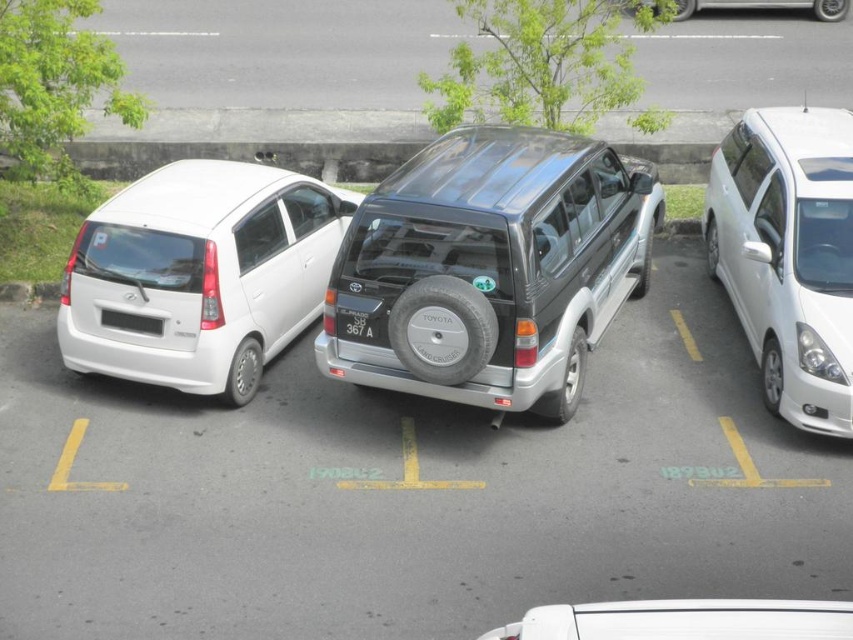
Can you confirm if satin silver suv at center is bigger than white matte car at center?

Indeed, satin silver suv at center has a larger size compared to white matte car at center.

Is point (582, 198) in front of point (851, 632)?

No, (582, 198) is behind (851, 632).

Where is `satin silver suv at center`? satin silver suv at center is located at coordinates pos(492,268).

Does white glossy minivan at right appear under black plastic license plate at rear?

Actually, white glossy minivan at right is above black plastic license plate at rear.

Between white glossy minivan at right and black plastic license plate at rear, which one is positioned lower?

black plastic license plate at rear

Who is more distant from viewer, (761, 246) or (160, 320)?

The point (761, 246) is more distant.

Locate an element on the screen. white glossy minivan at right is located at coordinates (788, 256).

Which is more to the left, white glossy minivan at right or metallic silver car at upper right?

white glossy minivan at right is more to the left.

Is white glossy minivan at right behind metallic silver car at upper right?

No, white glossy minivan at right is closer to the viewer.

Is point (828, 332) closer to camera compared to point (822, 1)?

Yes, point (828, 332) is in front of point (822, 1).

At what (x,y) coordinates should I click in order to perform the action: click on white glossy minivan at right. Please return your answer as a coordinate pair (x, y). This screenshot has width=853, height=640. Looking at the image, I should click on (788, 256).